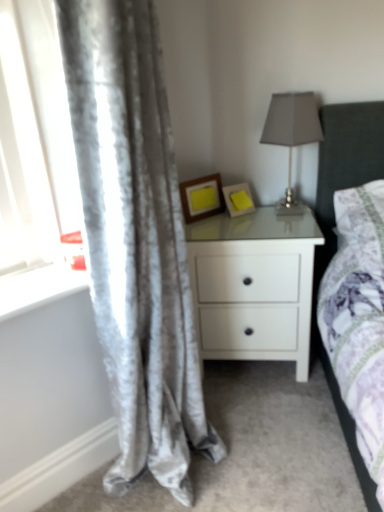
Find the location of `vacant area on top of white glossy window sill at lower left (from a real-world perspective)`. vacant area on top of white glossy window sill at lower left (from a real-world perspective) is located at coordinates (30, 276).